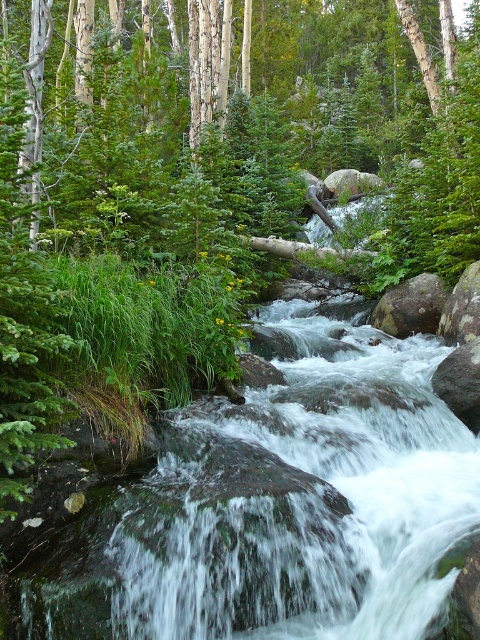
Between clear water at center and smooth gray rock at center, which one appears on the right side from the viewer's perspective?

smooth gray rock at center is more to the right.

Measure the distance between clear water at center and smooth gray rock at center.

They are 5.57 meters apart.

This screenshot has height=640, width=480. What are the coordinates of `clear water at center` in the screenshot? It's located at (276, 508).